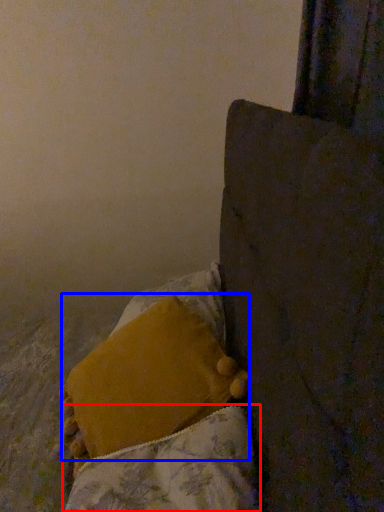
Question: Which object is further to the camera taking this photo, blanket (highlighted by a red box) or pillow (highlighted by a blue box)?

Choices:
 (A) blanket
 (B) pillow

Answer: (B)